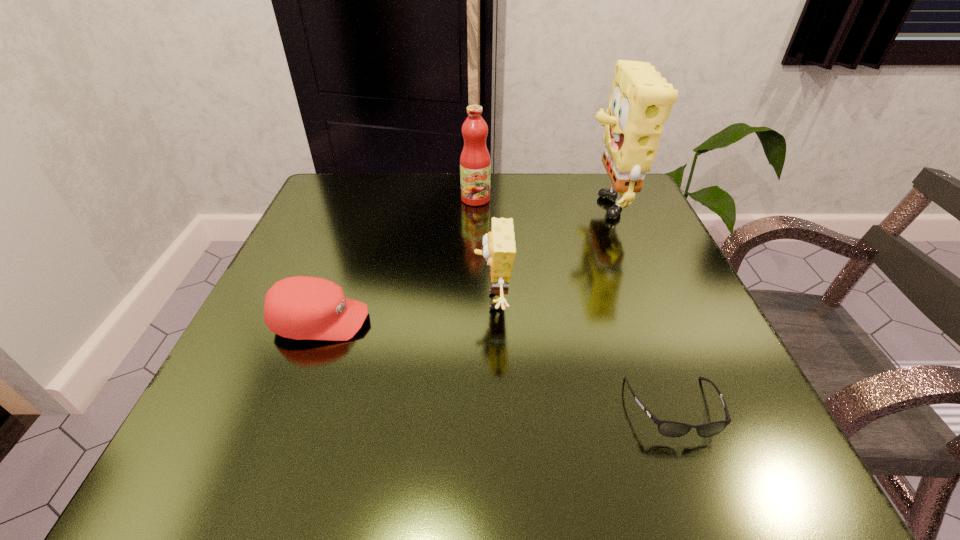
Find the location of a particular element. The height and width of the screenshot is (540, 960). free region that satisfies the following two spatial constraints: 1. on the front label of the second tallest object; 2. on the front-facing side of the second shortest object is located at coordinates (474, 321).

I want to click on free point that satisfies the following two spatial constraints: 1. on the face of the right sponge; 2. on the front-facing side of the nearest object, so click(x=686, y=408).

Find the location of a particular element. free spot that satisfies the following two spatial constraints: 1. on the front label of the fruit juice; 2. on the front-facing side of the fourth tallest object is located at coordinates (474, 321).